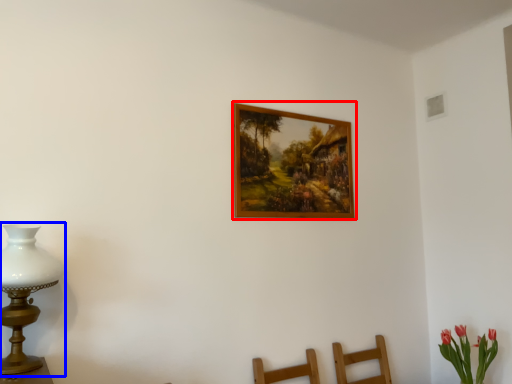
Question: Which object is closer to the camera taking this photo, picture frame (highlighted by a red box) or table lamp (highlighted by a blue box)?

Choices:
 (A) picture frame
 (B) table lamp

Answer: (B)